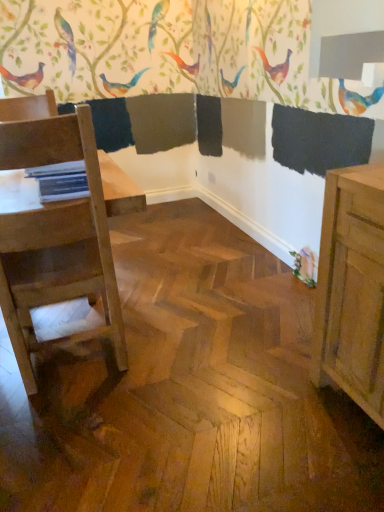
What do you see at coordinates (55, 239) in the screenshot? I see `wooden chair at left` at bounding box center [55, 239].

You are a GUI agent. You are given a task and a screenshot of the screen. Output one action in this format:
    pyautogui.click(x=<x>, y=<y>)
    Task: Click on the wooden chair at left
    
    Given the screenshot: What is the action you would take?
    pyautogui.click(x=55, y=239)

Identify the location of wooden chair at left. The height and width of the screenshot is (512, 384). (55, 239).